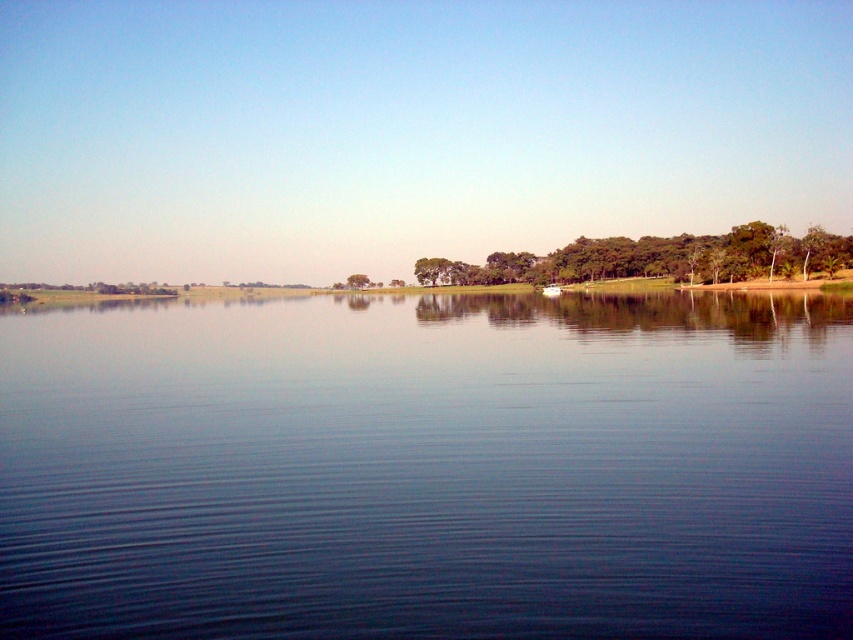
You are standing at the edge of the water and want to take a photo of both the blue smooth water at center and the green leafy tree at center. Which object should you frame first in your camera to ensure both are in the shot?

You should frame the green leafy tree at center first because the blue smooth water at center is positioned on the right side of it, so by centering the tree, the water will naturally be included to its right in the frame.

From the picture: You are a bird seeking shelter and want to choose between the green leafy trees at center and the green leafy tree at center. Which one provides more coverage for nesting?

The green leafy trees at center might be wider than green leafy tree at center, so they could provide more coverage for nesting.